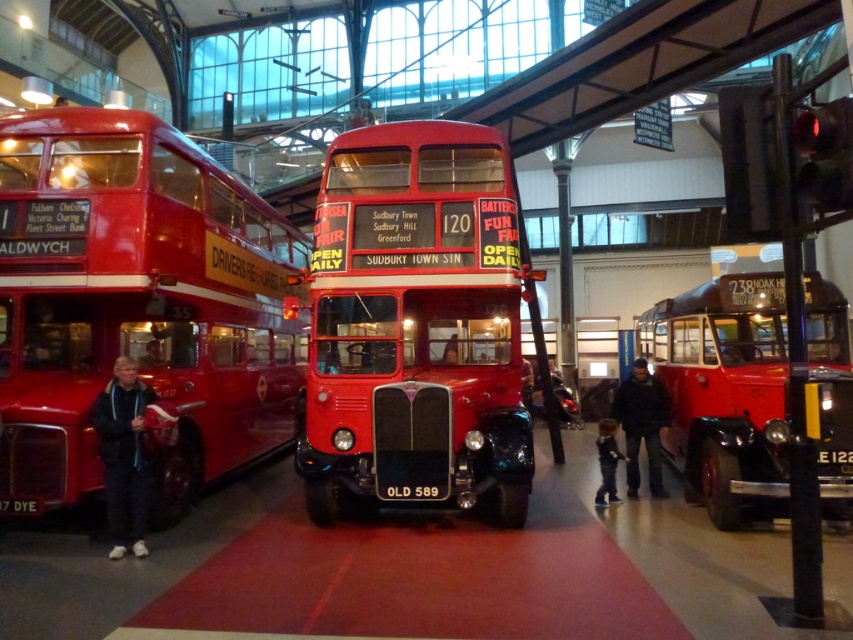
Question: Does matte red double-decker bus at left appear over dark blue jacket at center?

Choices:
 (A) yes
 (B) no

Answer: (A)

Question: Among these points, which one is farthest from the camera?

Choices:
 (A) (622, 454)
 (B) (494, 156)

Answer: (A)

Question: Does matte red double-decker bus at left appear under dark blue jeans at center?

Choices:
 (A) yes
 (B) no

Answer: (B)

Question: Among these objects, which one is farthest from the camera?

Choices:
 (A) dark blue fleece jacket at lower left
 (B) matte red double-decker bus at left
 (C) black plastic license plate at center
 (D) shiny red bus at right

Answer: (B)

Question: Can you confirm if dark blue jacket at center is positioned to the right of dark blue jeans at center?

Choices:
 (A) no
 (B) yes

Answer: (B)

Question: Which object is farther from the camera taking this photo?

Choices:
 (A) dark blue jacket at center
 (B) dark blue fleece jacket at lower left

Answer: (A)